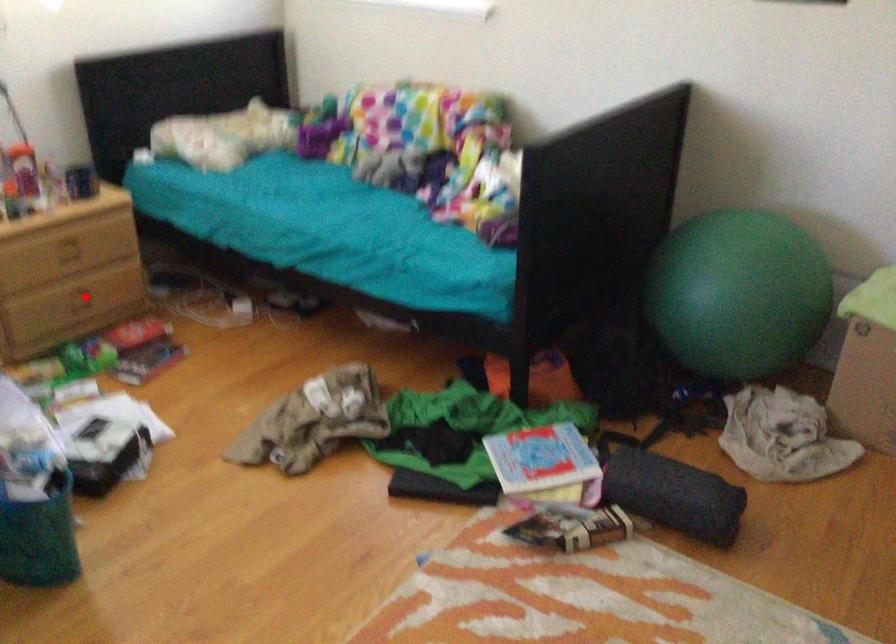
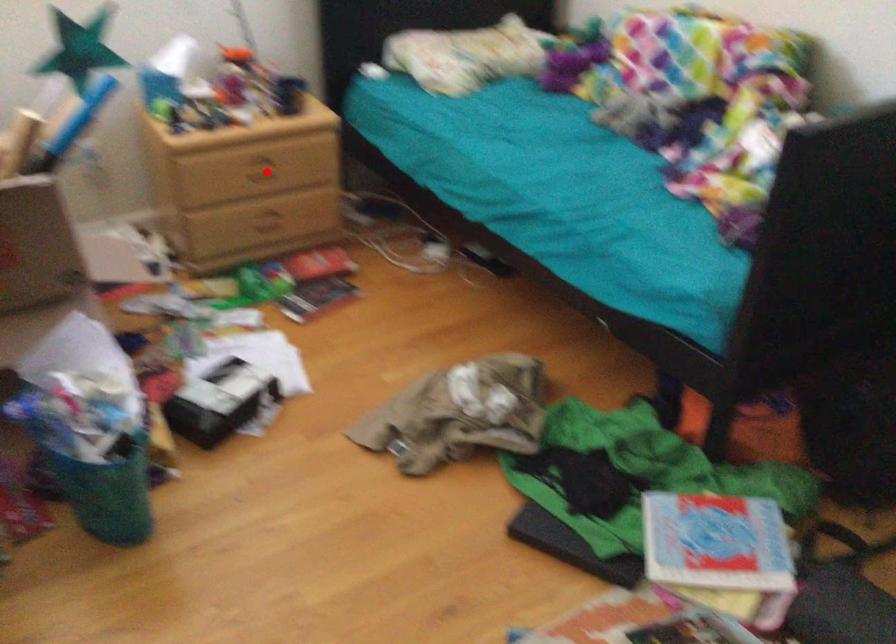
I am providing you with two images of the same scene from different viewpoints. A red point is marked on the first image and another point is marked on the second image. Does the point marked in image1 correspond to the same location as the one in image2?

No